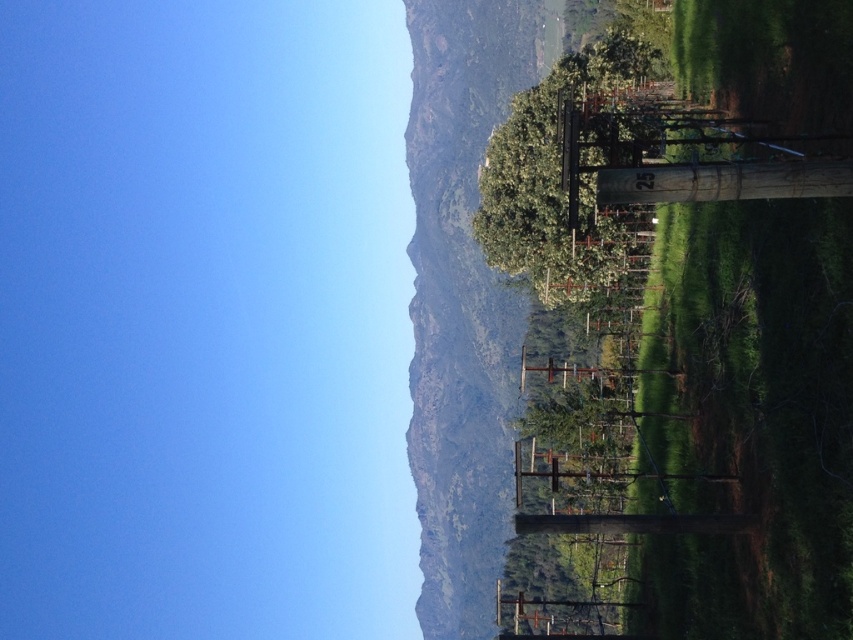
Which is in front, point (462, 45) or point (434, 97)?

Point (462, 45)

How much distance is there between green grassy hillside at right and green leafy hillside at upper center?

green grassy hillside at right and green leafy hillside at upper center are 11.66 meters apart from each other.

Is point (434, 273) positioned after point (509, 291)?

Yes, point (434, 273) is farther from viewer.

I want to click on green grassy hillside at right, so click(741, 419).

Is green grassy hillside at right positioned in front of green leafy tree at center?

Yes, it is.

Can you confirm if green grassy hillside at right is positioned to the right of green leafy tree at center?

Incorrect, green grassy hillside at right is not on the right side of green leafy tree at center.

At what (x,y) coordinates should I click in order to perform the action: click on green grassy hillside at right. Please return your answer as a coordinate pair (x, y). Image resolution: width=853 pixels, height=640 pixels. Looking at the image, I should click on (741, 419).

Is point (509, 44) farther from camera compared to point (521, 177)?

Yes, point (509, 44) is behind point (521, 177).

Identify the location of green leafy hillside at upper center. (463, 298).